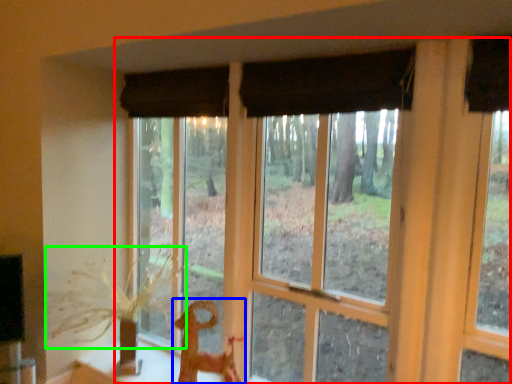
Question: Which object is positioned farthest from window (highlighted by a red box)? Select from animal (highlighted by a blue box) and plant (highlighted by a green box).

Choices:
 (A) animal
 (B) plant

Answer: (B)